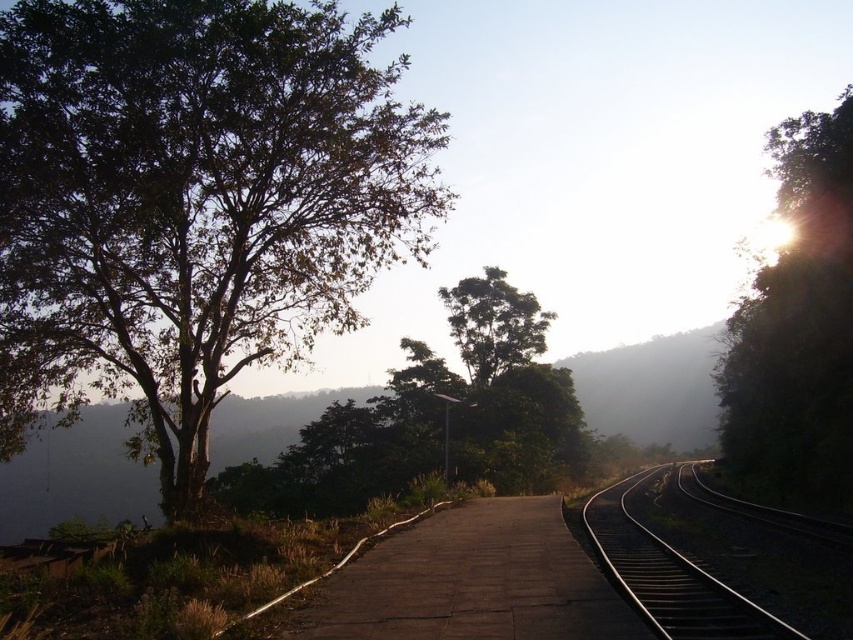
Between dark brown concrete path at center and green leafy tree at center, which one is positioned higher?

Positioned higher is green leafy tree at center.

Describe the element at coordinates (473, 582) in the screenshot. I see `dark brown concrete path at center` at that location.

Locate an element on the screen. This screenshot has width=853, height=640. dark brown concrete path at center is located at coordinates (473, 582).

Is green leafy tree at upper right above green leafy tree at center?

Yes.

Based on the photo, who is positioned more to the right, green leafy tree at upper right or green leafy tree at center?

green leafy tree at upper right

At what (x,y) coordinates should I click in order to perform the action: click on green leafy tree at upper right. Please return your answer as a coordinate pair (x, y). The height and width of the screenshot is (640, 853). Looking at the image, I should click on (798, 326).

Can you confirm if green leafy tree at left is positioned below metallic silver train track at center?

Actually, green leafy tree at left is above metallic silver train track at center.

In the scene shown: Which is below, green leafy tree at left or metallic silver train track at center?

metallic silver train track at center

Find the location of a particular element. green leafy tree at left is located at coordinates (193, 202).